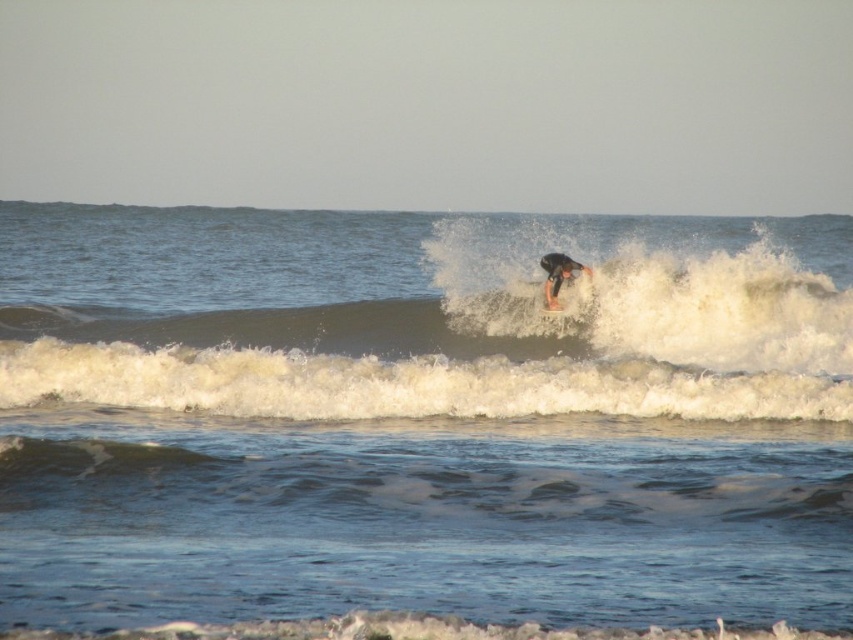
Question: Among these points, which one is farthest from the camera?

Choices:
 (A) tap(556, 310)
 (B) tap(799, 624)
 (C) tap(544, 291)

Answer: (C)

Question: Which point appears closest to the camera in this image?

Choices:
 (A) (556, 291)
 (B) (630, 323)
 (C) (566, 310)
 (D) (239, 358)

Answer: (D)

Question: Does smooth blue wave at center have a larger size compared to white foam surfboard at center?

Choices:
 (A) yes
 (B) no

Answer: (A)

Question: Does clear blue water at wave center appear on the right side of smooth blue wave at center?

Choices:
 (A) yes
 (B) no

Answer: (B)

Question: Does clear blue water at wave center come behind smooth blue wave at center?

Choices:
 (A) yes
 (B) no

Answer: (B)

Question: Which point is farther to the camera?

Choices:
 (A) clear blue water at wave center
 (B) white foam surfboard at center
 (C) black wetsuit surfer at center

Answer: (B)